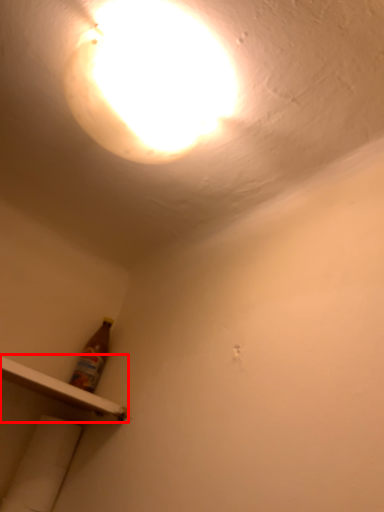
Question: From the image's perspective, where is shelf (annotated by the red box) located in relation to lamp in the image?

Choices:
 (A) above
 (B) below

Answer: (B)